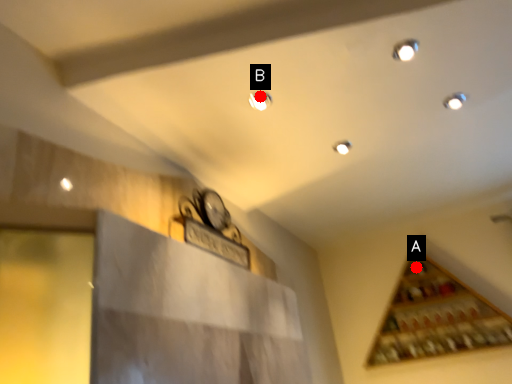
Question: Two points are circled on the image, labeled by A and B beside each circle. Which of the following is the closest to the observer?

Choices:
 (A) A is closer
 (B) B is closer

Answer: (B)